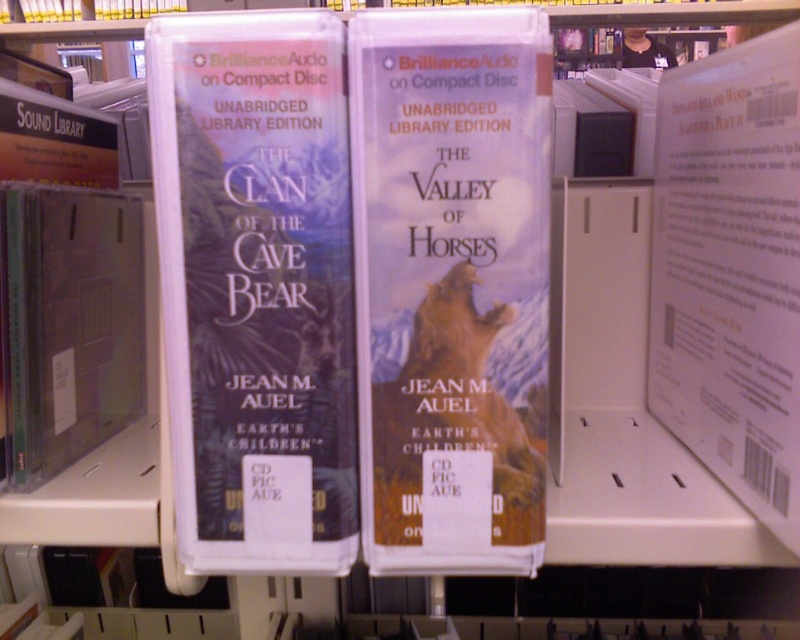
You are a photographer who needs to capture a clear image of the matte plastic book at center for a catalog. Your camera requires the subject to be at least 16 inches away to focus properly. Based on the scene, will you need to move closer or farther away to achieve focus?

The matte plastic book at center is 15.50 inches away from the camera, which is less than the required 16 inches. To achieve proper focus, you need to move farther away from the matte plastic book at center until it reaches the minimum distance requirement.

You are organizing a library shelf and see the matte paper cover at center and the matte plastic book at center. Which one is positioned to the right?

The matte paper cover at center is positioned to the right of the matte plastic book at center.

You are organizing a library shelf and need to place the matte plastic book at center and the white paper at upper right. According to their sizes, which one should be placed on the lower shelf to ensure stability?

The matte plastic book at center is shorter than the white paper at upper right. Since shorter items are typically placed on lower shelves for stability, the matte plastic book at center should be placed on the lower shelf.